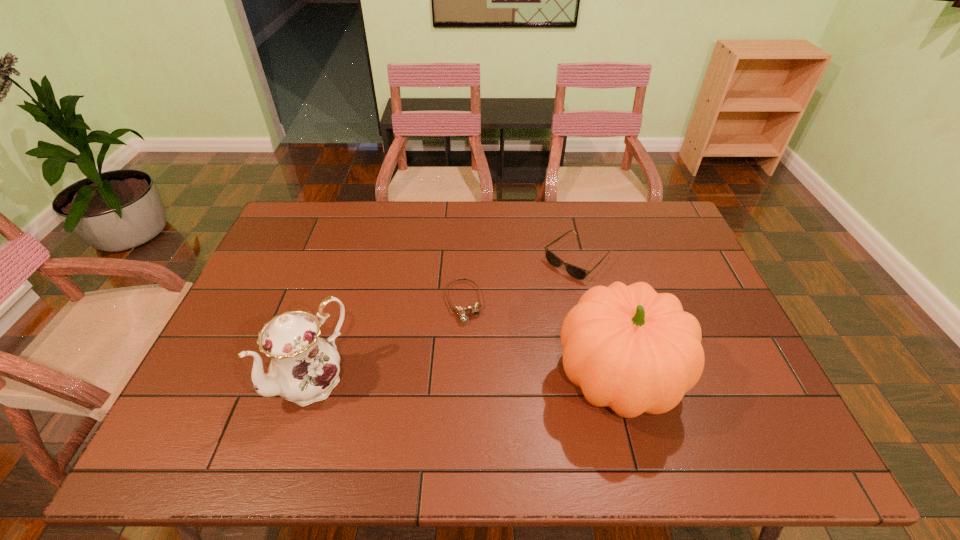
Identify the location of object that ranks as the closest to the chinaware. Image resolution: width=960 pixels, height=540 pixels. (474, 309).

Identify which object is the second closest to the second shortest object. Please provide its 2D coordinates. Your answer should be formatted as a tuple, i.e. [(x, y)], where the tuple contains the x and y coordinates of a point satisfying the conditions above.

[(474, 309)]

Find the location of a particular element. The image size is (960, 540). free region that satisfies the following two spatial constraints: 1. on the back side of the chinaware; 2. on the right side of the goggles is located at coordinates (338, 302).

At what (x,y) coordinates should I click in order to perform the action: click on vacant space that satisfies the following two spatial constraints: 1. on the back side of the third object from right to left; 2. on the left side of the third tallest object. Please return your answer as a coordinate pair (x, y). Looking at the image, I should click on (465, 259).